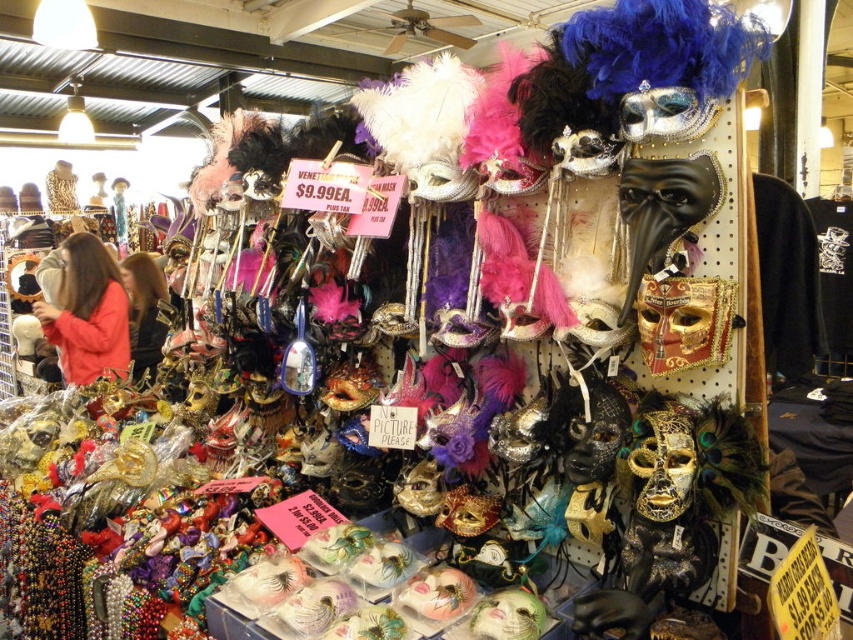
Question: Which point is closer to the camera?

Choices:
 (A) matte pink mask at upper left
 (B) dark brown leather jacket at center

Answer: (B)

Question: Can you confirm if matte pink mask at upper left is thinner than dark brown leather jacket at center?

Choices:
 (A) no
 (B) yes

Answer: (A)

Question: Does matte pink mask at upper left appear on the left side of dark brown leather jacket at center?

Choices:
 (A) no
 (B) yes

Answer: (B)

Question: Considering the relative positions of matte pink mask at upper left and dark brown leather jacket at center in the image provided, where is matte pink mask at upper left located with respect to dark brown leather jacket at center?

Choices:
 (A) left
 (B) right

Answer: (A)